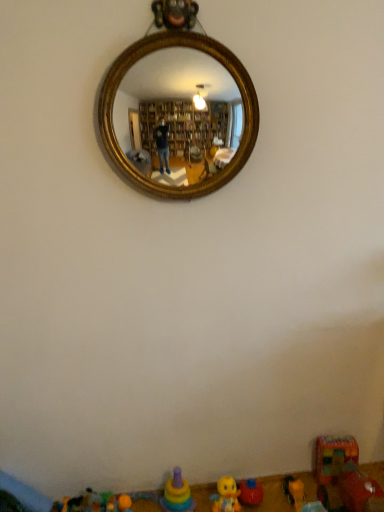
Question: Does plastic multicolored car at lower right, which is the first toy from right to left, turn towards yellow plastic toy at lower right, which is the 6th toy from left to right?

Choices:
 (A) no
 (B) yes

Answer: (A)

Question: Is plastic multicolored car at lower right, which is the first toy from right to left, positioned behind yellow plastic toy at lower right, which is the 6th toy from left to right?

Choices:
 (A) yes
 (B) no

Answer: (B)

Question: Does plastic multicolored car at lower right, which is the first toy from right to left, appear on the right side of yellow plastic toy at lower right, which is the 6th toy from left to right?

Choices:
 (A) yes
 (B) no

Answer: (A)

Question: From a real-world perspective, is plastic multicolored car at lower right, which is the first toy from right to left, below yellow plastic toy at lower right, which is the 6th toy from left to right?

Choices:
 (A) yes
 (B) no

Answer: (B)

Question: Is plastic multicolored car at lower right, which is the first toy from right to left, shorter than yellow plastic toy at lower right, which is the 6th toy from left to right?

Choices:
 (A) yes
 (B) no

Answer: (B)

Question: From a real-world perspective, relative to yellow rubber duck at lower center, the 4th toy viewed from the left, is multicolored plastic stacking rings at lower center, acting as the 5th toy starting from the right, vertically above or below?

Choices:
 (A) above
 (B) below

Answer: (A)

Question: In terms of width, does multicolored plastic stacking rings at lower center, acting as the 3th toy starting from the left, look wider or thinner when compared to yellow rubber duck at lower center, the 4th toy viewed from the left?

Choices:
 (A) thin
 (B) wide

Answer: (B)

Question: Considering their positions, is multicolored plastic stacking rings at lower center, acting as the 5th toy starting from the right, located in front of or behind yellow rubber duck at lower center, the 4th toy viewed from the left?

Choices:
 (A) front
 (B) behind

Answer: (A)

Question: From their relative heights in the image, would you say multicolored plastic stacking rings at lower center, acting as the 3th toy starting from the left, is taller or shorter than yellow rubber duck at lower center, which is the fourth toy in right-to-left order?

Choices:
 (A) tall
 (B) short

Answer: (A)

Question: In terms of height, does rubber duck at lower center, which is the third toy from right to left, look taller or shorter compared to plastic multicolored car at lower right, which appears as the seventh toy when viewed from the left?

Choices:
 (A) tall
 (B) short

Answer: (B)

Question: Considering the positions of rubber duck at lower center, which is the third toy from right to left, and plastic multicolored car at lower right, which appears as the seventh toy when viewed from the left, in the image, is rubber duck at lower center, which is the third toy from right to left, bigger or smaller than plastic multicolored car at lower right, which appears as the seventh toy when viewed from the left,?

Choices:
 (A) big
 (B) small

Answer: (B)

Question: Would you say rubber duck at lower center, the fifth toy viewed from the left, is to the left or to the right of plastic multicolored car at lower right, which is the first toy from right to left, in the picture?

Choices:
 (A) right
 (B) left

Answer: (B)

Question: From a real-world perspective, is rubber duck at lower center, the fifth toy viewed from the left, above or below plastic multicolored car at lower right, which is the first toy from right to left?

Choices:
 (A) above
 (B) below

Answer: (B)

Question: From the image's perspective, is multicolored plastic stacking rings at lower center, acting as the 5th toy starting from the right, above or below orange rubber ball at lower center, the 6th toy in the right-to-left sequence?

Choices:
 (A) below
 (B) above

Answer: (B)

Question: Is multicolored plastic stacking rings at lower center, acting as the 5th toy starting from the right, inside or outside of orange rubber ball at lower center, the 6th toy in the right-to-left sequence?

Choices:
 (A) inside
 (B) outside

Answer: (B)